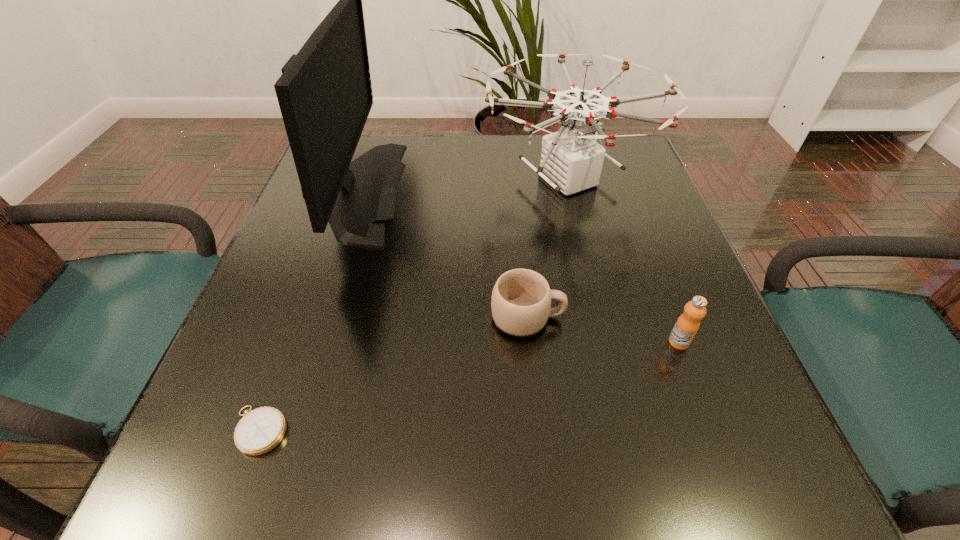
The width and height of the screenshot is (960, 540). I want to click on vacant region located 0.400m on the right of the compass, so click(x=573, y=430).

The width and height of the screenshot is (960, 540). What are the coordinates of `monitor that is positioned at the far edge` in the screenshot? It's located at (325, 95).

This screenshot has width=960, height=540. Find the location of `drone present at the far edge`. drone present at the far edge is located at coordinates (571, 161).

The height and width of the screenshot is (540, 960). In order to click on object positioned at the near edge in this screenshot , I will do `click(262, 429)`.

Where is `monitor present at the left edge`? The image size is (960, 540). monitor present at the left edge is located at coordinates (325, 95).

Where is `compass positioned at the left edge`? compass positioned at the left edge is located at coordinates (262, 429).

What are the coordinates of `drone situated at the right edge` in the screenshot? It's located at click(571, 161).

The height and width of the screenshot is (540, 960). In order to click on orange juice at the right edge in this screenshot , I will do tap(687, 325).

This screenshot has height=540, width=960. What are the coordinates of `object positioned at the far left corner` in the screenshot? It's located at (x=325, y=95).

Identify the location of object at the near left corner. This screenshot has width=960, height=540. (262, 429).